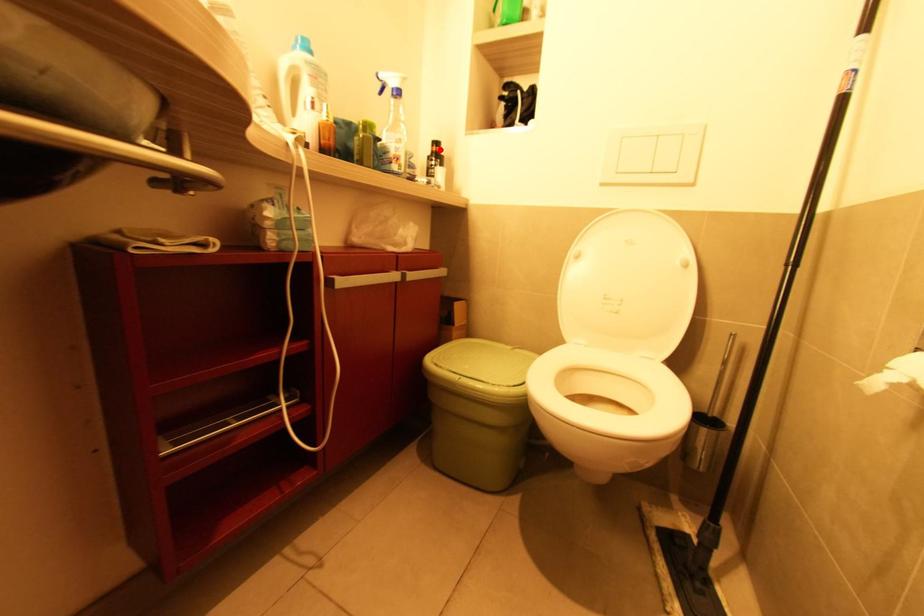
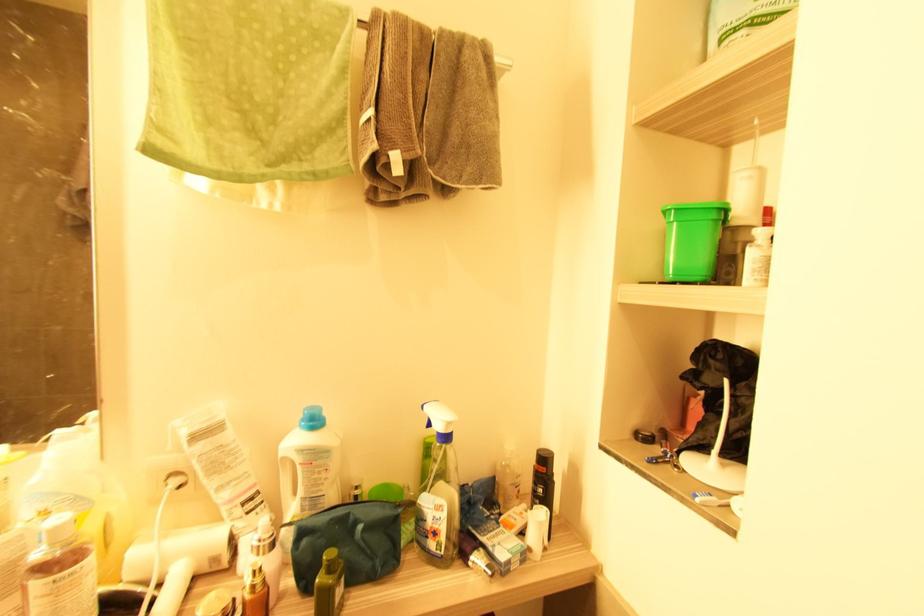
Question: I am providing you with two images of the same scene from different viewpoints. In image1, a red point is highlighted. Considering the same 3D point in image2, which of the following is correct?

Choices:
 (A) It is closer
 (B) It is farther

Answer: (B)